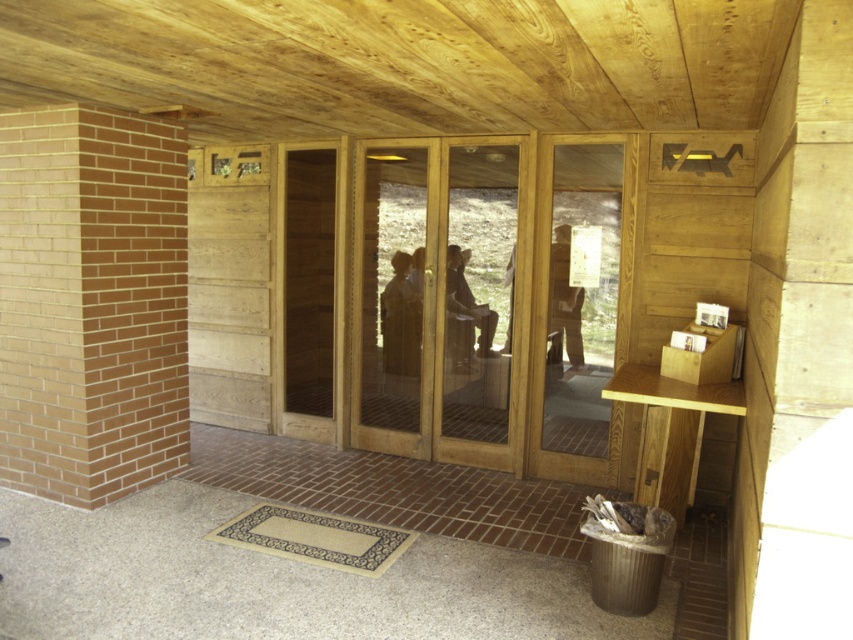
Image resolution: width=853 pixels, height=640 pixels. Find the location of `transparent glass door at center`. transparent glass door at center is located at coordinates (581, 305).

From the picture: Which is above, transparent glass door at center or smooth brown hair at center?

Positioned higher is smooth brown hair at center.

Who is more distant from viewer, [570,364] or [448,292]?

Positioned behind is point [448,292].

The width and height of the screenshot is (853, 640). I want to click on transparent glass door at center, so click(x=581, y=305).

Can you confirm if translucent wood door at center is bigger than leather boots at center?

Indeed, translucent wood door at center has a larger size compared to leather boots at center.

Is translucent wood door at center wider than leather boots at center?

Yes, translucent wood door at center is wider than leather boots at center.

Measure the distance between point (410,358) and camera.

Point (410,358) is 4.87 meters away from camera.

At what (x,y) coordinates should I click in order to perform the action: click on translucent wood door at center. Please return your answer as a coordinate pair (x, y). Looking at the image, I should click on (392, 298).

Looking at this image, which of these two, transparent glass door at center or leather boots at center, stands taller?

Standing taller between the two is transparent glass door at center.

Is transparent glass door at center smaller than leather boots at center?

No.

This screenshot has height=640, width=853. In order to click on transparent glass door at center in this screenshot , I will do `click(581, 305)`.

The width and height of the screenshot is (853, 640). I want to click on transparent glass door at center, so click(581, 305).